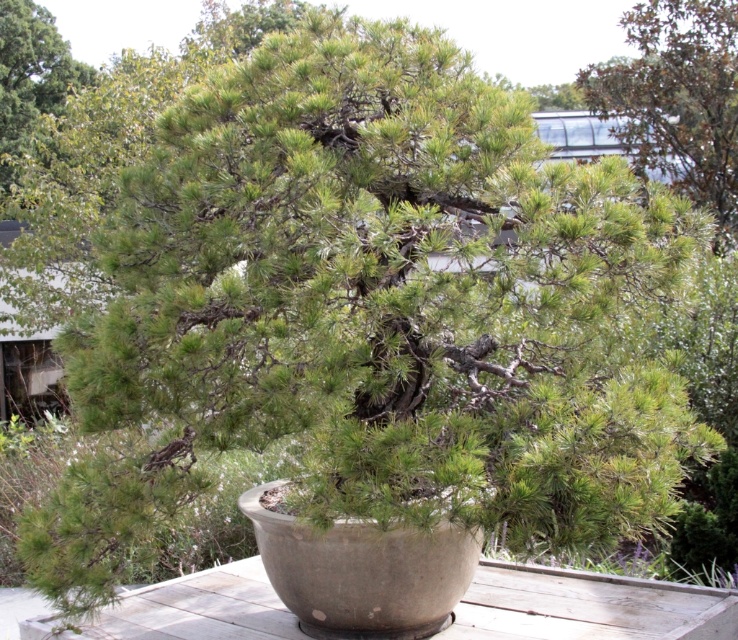
You are standing at the edge of the wooden deck where the bonsai tree is placed. You see two points marked in the image. The first point is at coordinate point (x=624, y=92), and the second is at point (x=44, y=54). Which point is closer to you?

Point (x=624, y=92) is in front of point (x=44, y=54), so it is closer to you.